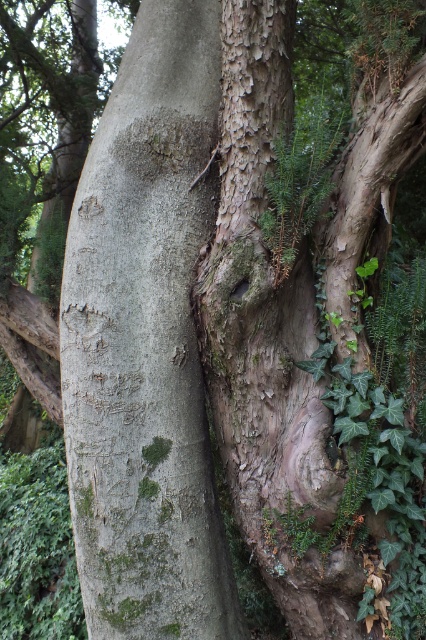
Is green mossy bark at center thinner than smooth bark tree trunk at center?

No.

Between point (187, 72) and point (233, 442), which one is positioned behind?

The point (187, 72) is more distant.

Where is `green mossy bark at center`? This screenshot has width=426, height=640. green mossy bark at center is located at coordinates 146,342.